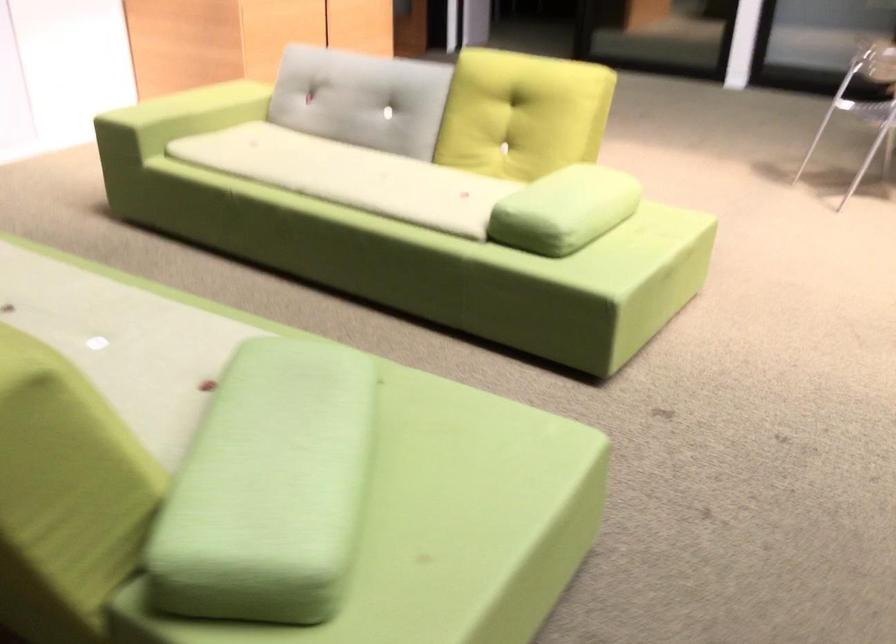
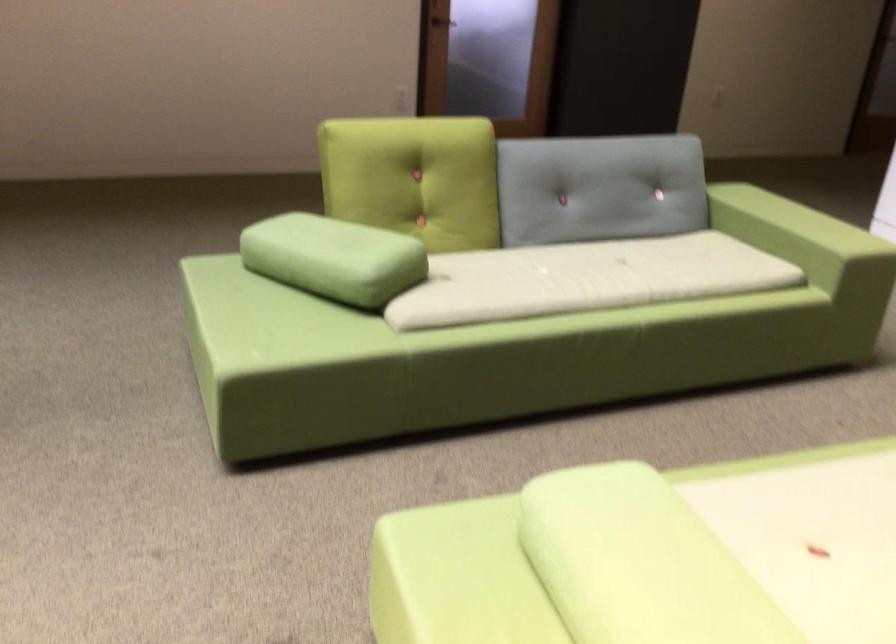
The point at (572, 185) is marked in the first image. Where is the corresponding point in the second image?

(651, 556)